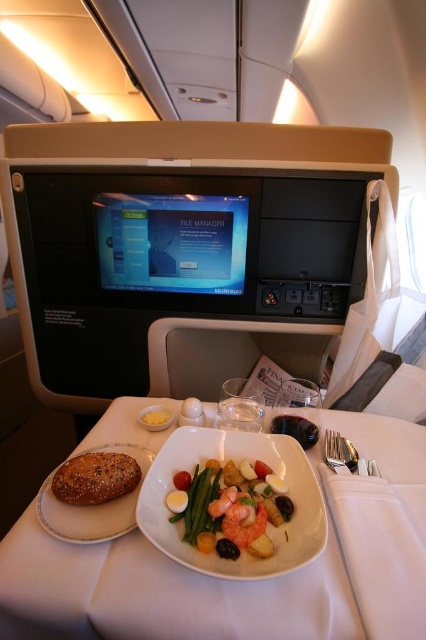
Does white porcelain plate at center appear over green smooth-textured beans at center?

No, white porcelain plate at center is not above green smooth-textured beans at center.

Between white porcelain plate at center and green smooth-textured beans at center, which one appears on the right side from the viewer's perspective?

Positioned to the right is white porcelain plate at center.

Between point (20, 557) and point (189, 518), which one is positioned behind?

Point (189, 518)

Where is `white porcelain plate at center`? The image size is (426, 640). white porcelain plate at center is located at coordinates (164, 593).

Who is taller, brown seeded bread at left or green smooth-textured beans at center?

brown seeded bread at left is taller.

From the picture: Can you confirm if brown seeded bread at left is positioned below green smooth-textured beans at center?

Actually, brown seeded bread at left is above green smooth-textured beans at center.

The height and width of the screenshot is (640, 426). Find the location of `brown seeded bread at left`. brown seeded bread at left is located at coordinates (94, 477).

Locate an element on the screen. This screenshot has width=426, height=640. brown seeded bread at left is located at coordinates coord(94,477).

Does point (192, 506) come in front of point (160, 422)?

Yes, it is.

Between green smooth-textured beans at center and yellow matte bread at left, which one appears on the right side from the viewer's perspective?

green smooth-textured beans at center is more to the right.

You are a GUI agent. You are given a task and a screenshot of the screen. Output one action in this format:
    pyautogui.click(x=<x>, y=<y>)
    Task: Click on the green smooth-textured beans at center
    
    Given the screenshot: What is the action you would take?
    pyautogui.click(x=199, y=502)

Image resolution: width=426 pixels, height=640 pixels. I want to click on green smooth-textured beans at center, so pyautogui.click(x=199, y=502).